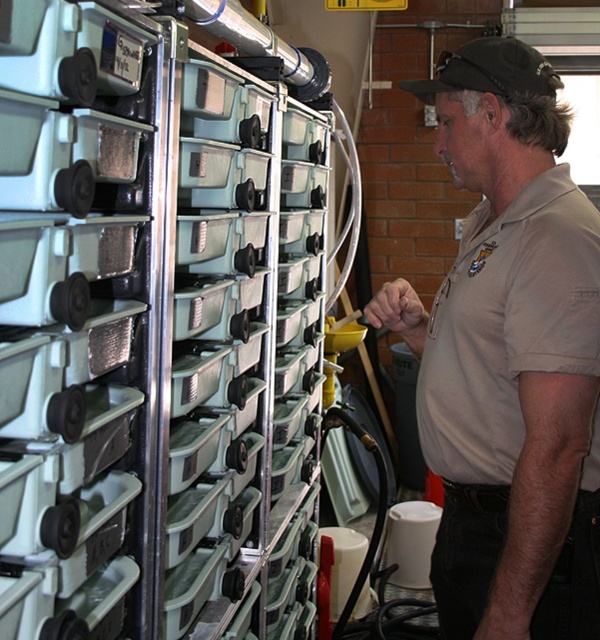
Based on the photo, is matte plastic drawers at center further to camera compared to beige uniform at center?

No, matte plastic drawers at center is closer to the viewer.

Is point (160, 563) farther from camera compared to point (595, 380)?

No, (160, 563) is closer to viewer.

Where is `matte plastic drawers at center`? This screenshot has height=640, width=600. matte plastic drawers at center is located at coordinates (154, 326).

Can you confirm if matte plastic drawers at center is positioned to the right of black fabric baseball cap at upper center?

In fact, matte plastic drawers at center is to the left of black fabric baseball cap at upper center.

Is point (126, 275) closer to viewer compared to point (491, 49)?

Yes.

The width and height of the screenshot is (600, 640). Identify the location of matte plastic drawers at center. (154, 326).

Can you confirm if beige uniform at center is bigger than black fabric baseball cap at upper center?

Yes, beige uniform at center is bigger than black fabric baseball cap at upper center.

Which is behind, point (559, 140) or point (469, 61)?

The point (559, 140) is more distant.

The height and width of the screenshot is (640, 600). What are the coordinates of `beige uniform at center` in the screenshot? It's located at (510, 356).